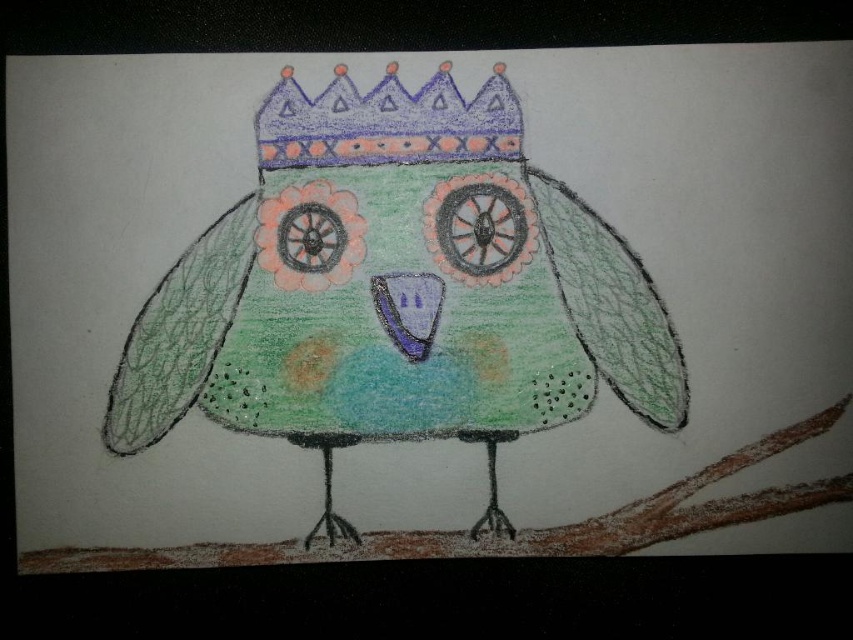
You are an artist who wants to draw a similar owl. You have a pastel green paper bird at center and a purple crayon crown at upper center. Which object should you draw first if you want to follow the top to bottom drawing order?

You should draw the purple crayon crown at upper center first because it is located above the pastel green paper bird at center.

You are an artist trying to create a new design for a greeting card. You have a pastel green paper bird at center and a purple crayon crown at upper center. Which object should you choose if you want to feature a larger element in your design?

The pastel green paper bird at center has a larger size compared to the purple crayon crown at upper center, so you should choose the pastel green paper bird at center for a larger element in your design.

From the picture: You are an artist who wants to place a new sticker on the drawing. The sticker must be placed exactly at the point marked by point (397, 291). What object will the sticker overlap with?

The sticker placed at point (397, 291) will overlap with the pastel green paper bird at center.